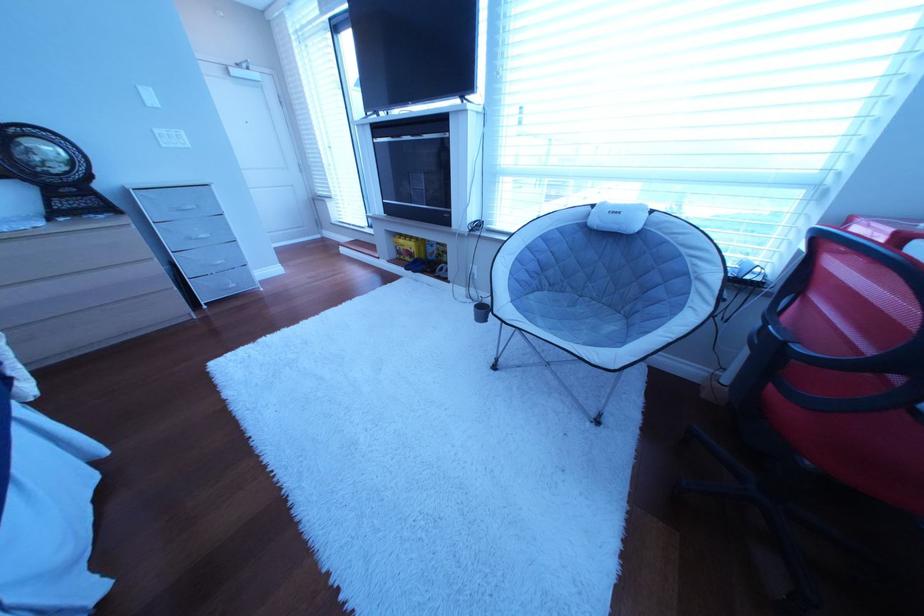
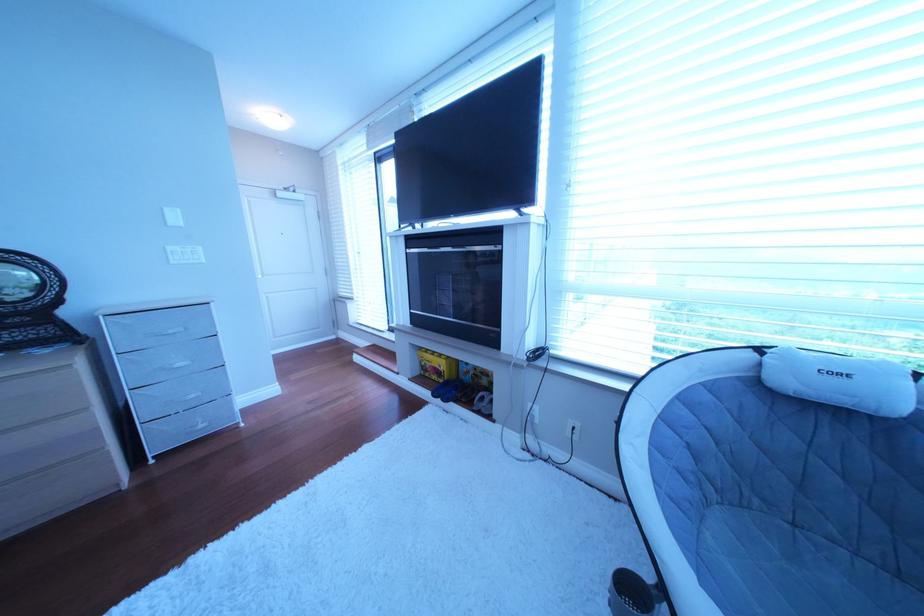
The point at (418, 251) is marked in the first image. Where is the corresponding point in the second image?

(444, 367)